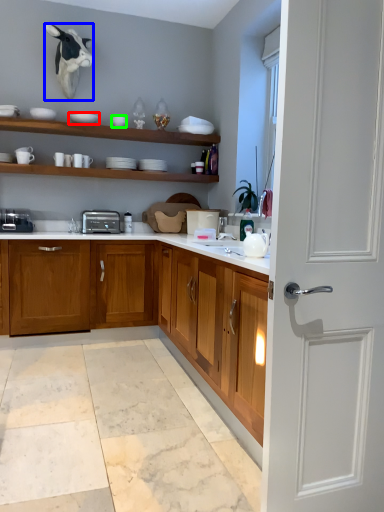
Question: Which object is positioned closest to tableware (highlighted by a red box)? Select from animal (highlighted by a blue box) and tableware (highlighted by a green box).

Choices:
 (A) animal
 (B) tableware

Answer: (B)